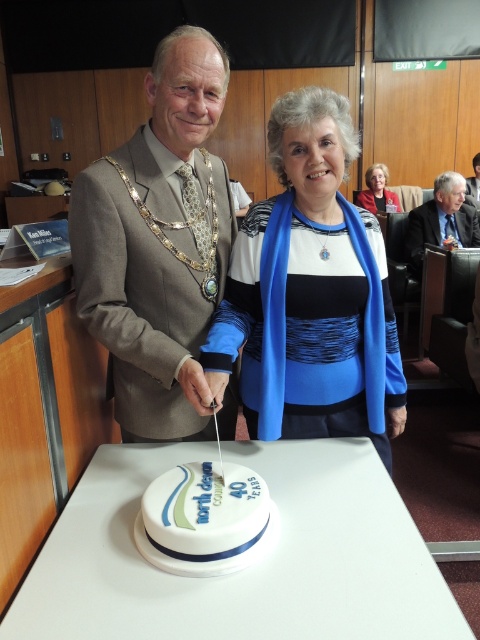
Question: Estimate the real-world distances between objects in this image. Which object is closer to the blue suit at center?

Choices:
 (A) white glossy table at center
 (B) white fondant cake at center
 (C) matte gold chain at center

Answer: (C)

Question: In this image, where is matte gold chain at center located relative to gray suit at center?

Choices:
 (A) left
 (B) right

Answer: (A)

Question: Is blue fabric scarf at center further to the viewer compared to blue fabric at center?

Choices:
 (A) no
 (B) yes

Answer: (A)

Question: Where is white fondant cake at center located in relation to blue fabric at center in the image?

Choices:
 (A) above
 (B) below

Answer: (B)

Question: Which of the following is the farthest from the observer?

Choices:
 (A) pos(335,230)
 (B) pos(110,522)
 (C) pos(439,182)

Answer: (C)

Question: Which object is the closest to the white fondant cake at center?

Choices:
 (A) matte gold chain at center
 (B) white glossy table at center
 (C) blue fabric at center
 (D) gray suit at center

Answer: (B)